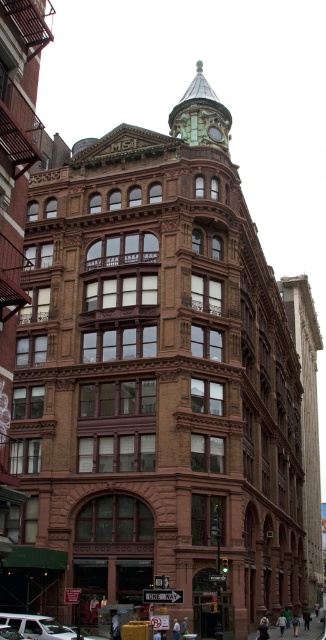
You are standing in front of the historic building and notice two points marked on its facade. The first point is at coordinate point (35, 616) and the second is at point (210, 125). Which point is closer to you as you face the building?

Point (35, 616) is closer to you because it is in front of point (210, 125).

You are standing at the center of the image and want to locate the white matte van at lower left. In which direction should you look to find it?

You should look to the lower left direction to find the white matte van at lower left as its 2D location is at point (36, 627).

You are a delivery driver who needs to park your white matte van at lower left near the green glass clock at upper center. Based on their heights, can you safely park the van without blocking the clock?

The white matte van at lower left is taller than the green glass clock at upper center, so parking the van might block the view of the clock if positioned too close. Ensure there is enough vertical clearance between the van and the clock to avoid obstruction.